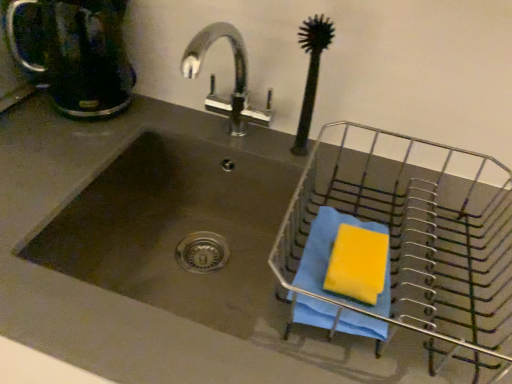
Locate an element on the screen. The width and height of the screenshot is (512, 384). vacant space situated on the left part of black rubber brush at upper right is located at coordinates 227,134.